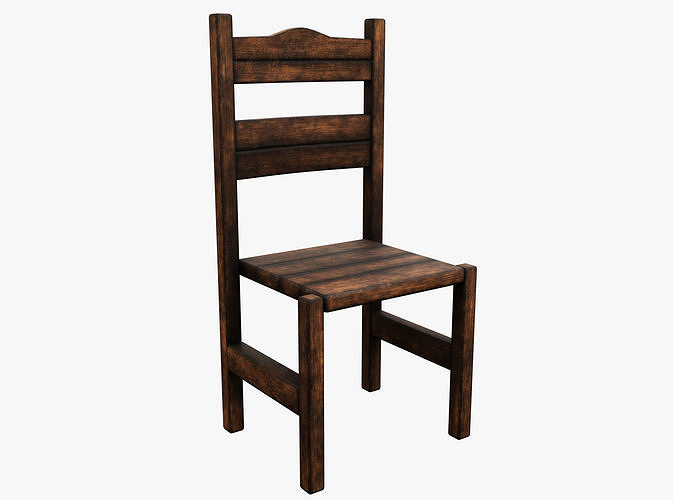
You are a GUI agent. You are given a task and a screenshot of the screen. Output one action in this format:
    pyautogui.click(x=<x>, y=<y>)
    Task: Click on the left front leg
    
    Given the screenshot: What is the action you would take?
    pyautogui.click(x=459, y=372)